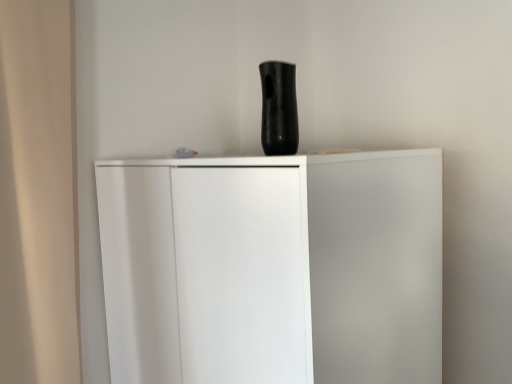
I want to click on black glossy vase at upper center, so click(x=279, y=108).

The image size is (512, 384). Describe the element at coordinates (279, 108) in the screenshot. I see `black glossy vase at upper center` at that location.

Where is `white matte cupboard at center`? The height and width of the screenshot is (384, 512). white matte cupboard at center is located at coordinates (273, 268).

Describe the element at coordinates (273, 268) in the screenshot. This screenshot has height=384, width=512. I see `white matte cupboard at center` at that location.

Where is `black glossy vase at upper center`? This screenshot has height=384, width=512. black glossy vase at upper center is located at coordinates (279, 108).

Consider the image. Is black glossy vase at upper center to the left of white matte cupboard at center from the viewer's perspective?

Incorrect, black glossy vase at upper center is not on the left side of white matte cupboard at center.

Is black glossy vase at upper center in front of white matte cupboard at center?

No, black glossy vase at upper center is further to the viewer.

Is point (292, 76) closer to camera compared to point (421, 288)?

Yes.

From the image's perspective, is black glossy vase at upper center located above or below white matte cupboard at center?

Based on their image positions, black glossy vase at upper center is located above white matte cupboard at center.

From a real-world perspective, is black glossy vase at upper center on top of white matte cupboard at center?

Yes.

From the picture: Considering the relative sizes of black glossy vase at upper center and white matte cupboard at center in the image provided, is black glossy vase at upper center thinner than white matte cupboard at center?

Indeed, black glossy vase at upper center has a lesser width compared to white matte cupboard at center.

In terms of height, does black glossy vase at upper center look taller or shorter compared to white matte cupboard at center?

Clearly, black glossy vase at upper center is shorter compared to white matte cupboard at center.

Who is smaller, black glossy vase at upper center or white matte cupboard at center?

Smaller between the two is black glossy vase at upper center.

Is black glossy vase at upper center spatially inside white matte cupboard at center, or outside of it?

black glossy vase at upper center is not enclosed by white matte cupboard at center.

Is black glossy vase at upper center not close to white matte cupboard at center?

No, black glossy vase at upper center is in close proximity to white matte cupboard at center.

Is black glossy vase at upper center positioned with its back to white matte cupboard at center?

No, black glossy vase at upper center is not facing the opposite direction of white matte cupboard at center.

How many degrees apart are the facing directions of black glossy vase at upper center and white matte cupboard at center?

The angular difference between black glossy vase at upper center and white matte cupboard at center is 4.6e-05 degrees.

How much distance is there between black glossy vase at upper center and white matte cupboard at center?

16.60 inches.

Where is `vase that appears above the white matte cupboard at center (from a real-world perspective)`? vase that appears above the white matte cupboard at center (from a real-world perspective) is located at coordinates (279, 108).

Which is more to the right, white matte cupboard at center or black glossy vase at upper center?

From the viewer's perspective, black glossy vase at upper center appears more on the right side.

Considering the positions of objects white matte cupboard at center and black glossy vase at upper center in the image provided, who is in front, white matte cupboard at center or black glossy vase at upper center?

white matte cupboard at center is closer to the camera.

Is point (211, 281) closer or farther from the camera than point (260, 65)?

Point (211, 281) appears to be closer to the viewer than point (260, 65).

From the image's perspective, is white matte cupboard at center on top of black glossy vase at upper center?

No.

From a real-world perspective, is white matte cupboard at center positioned over black glossy vase at upper center based on gravity?

No, from a real-world perspective, white matte cupboard at center is not over black glossy vase at upper center

Looking at this image, in terms of width, does white matte cupboard at center look wider or thinner when compared to black glossy vase at upper center?

In the image, white matte cupboard at center appears to be wider than black glossy vase at upper center.

Can you confirm if white matte cupboard at center is taller than black glossy vase at upper center?

Yes, white matte cupboard at center is taller than black glossy vase at upper center.

Considering the sizes of objects white matte cupboard at center and black glossy vase at upper center in the image provided, who is smaller, white matte cupboard at center or black glossy vase at upper center?

With smaller size is black glossy vase at upper center.

Is white matte cupboard at center positioned beyond the bounds of black glossy vase at upper center?

white matte cupboard at center lies outside black glossy vase at upper center's area.

Are white matte cupboard at center and black glossy vase at upper center beside each other?

white matte cupboard at center and black glossy vase at upper center are not in contact.

Is white matte cupboard at center looking in the opposite direction of black glossy vase at upper center?

white matte cupboard at center is not turned away from black glossy vase at upper center.

Find the location of a particular element. cupboard below the black glossy vase at upper center (from the image's perspective) is located at coordinates (273, 268).

The image size is (512, 384). What are the coordinates of `cupboard below the black glossy vase at upper center (from the image's perspective)` in the screenshot? It's located at (273, 268).

At what (x,y) coordinates should I click in order to perform the action: click on cupboard in front of the black glossy vase at upper center. Please return your answer as a coordinate pair (x, y). The width and height of the screenshot is (512, 384). Looking at the image, I should click on (273, 268).